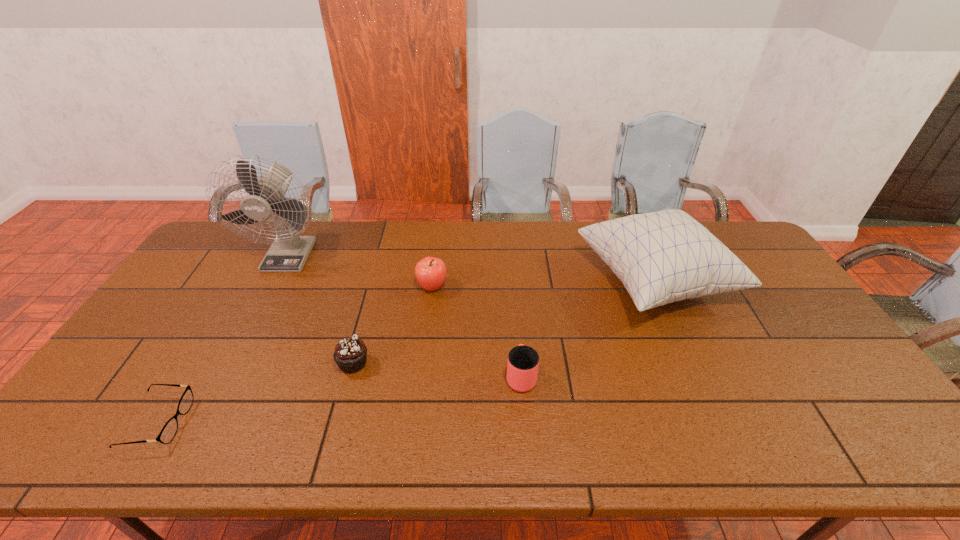
In order to click on spectacles that is at the left edge in this screenshot , I will do `click(168, 432)`.

This screenshot has height=540, width=960. In order to click on object located in the far left corner section of the desktop in this screenshot , I will do `click(289, 251)`.

The image size is (960, 540). I want to click on object that is at the near left corner, so (168, 432).

This screenshot has height=540, width=960. What are the coordinates of `vacant region at the far edge` in the screenshot? It's located at (492, 225).

Find the location of `vacant space at the left edge of the desktop`. vacant space at the left edge of the desktop is located at coordinates (197, 316).

Locate an element on the screen. Image resolution: width=960 pixels, height=540 pixels. vacant space at the right edge is located at coordinates (855, 420).

You are a GUI agent. You are given a task and a screenshot of the screen. Output one action in this format:
    pyautogui.click(x=<x>, y=<y>)
    Task: Click on the vacant space at the far left corner of the desktop
    Image resolution: width=960 pixels, height=540 pixels.
    Given the screenshot: What is the action you would take?
    pyautogui.click(x=232, y=247)

The width and height of the screenshot is (960, 540). In the image, there is a desktop. Find the location of `vacant space at the near left corner`. vacant space at the near left corner is located at coordinates (78, 434).

Locate an element on the screen. Image resolution: width=960 pixels, height=540 pixels. empty location between the cupcake and the tallest object is located at coordinates (322, 308).

Where is `free space that is in between the cup and the fourth object from left to right`? This screenshot has height=540, width=960. free space that is in between the cup and the fourth object from left to right is located at coordinates (476, 332).